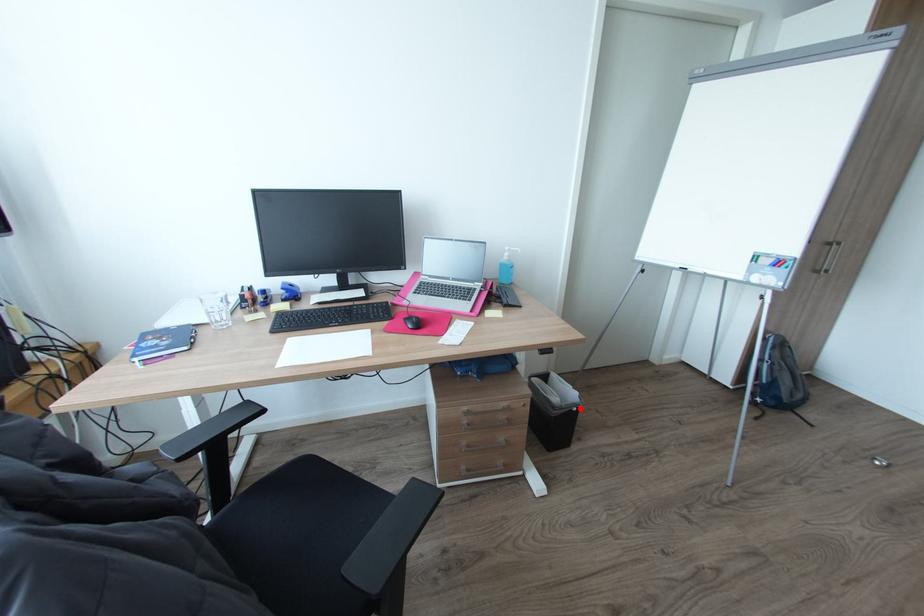
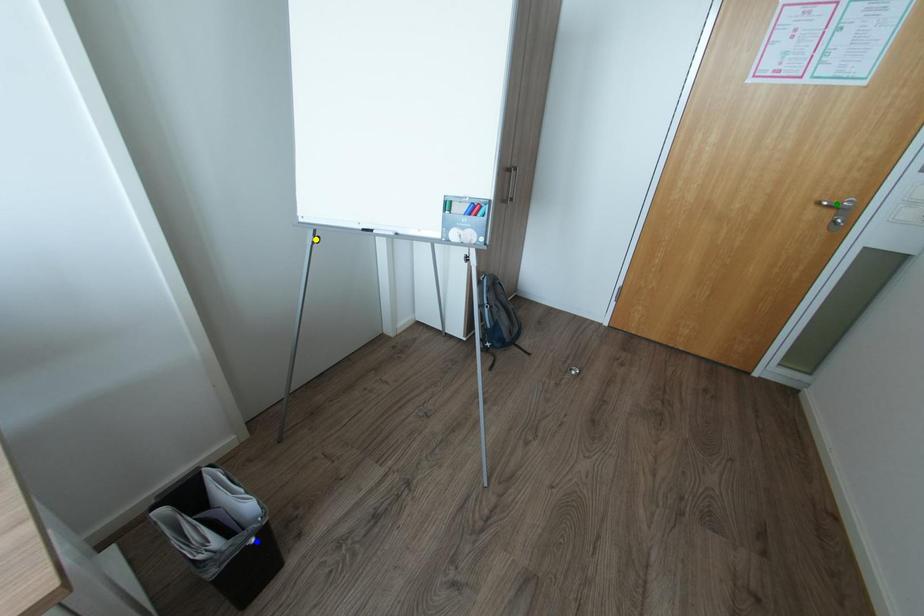
Question: I am providing you with two images of the same scene from different viewpoints. A red point is marked on the first image. You are given multiple points on the second image. Which spot in image 2 lines up with the point in image 1?

Choices:
 (A) yellow point
 (B) green point
 (C) blue point

Answer: (C)